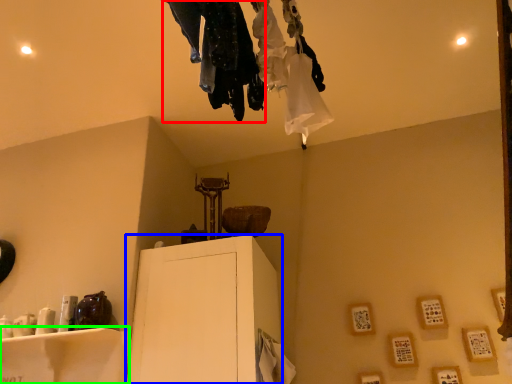
Question: Which is farther away from clothing (highlighted by a red box)? furniture (highlighted by a blue box) or furniture (highlighted by a green box)?

Choices:
 (A) furniture
 (B) furniture

Answer: (B)